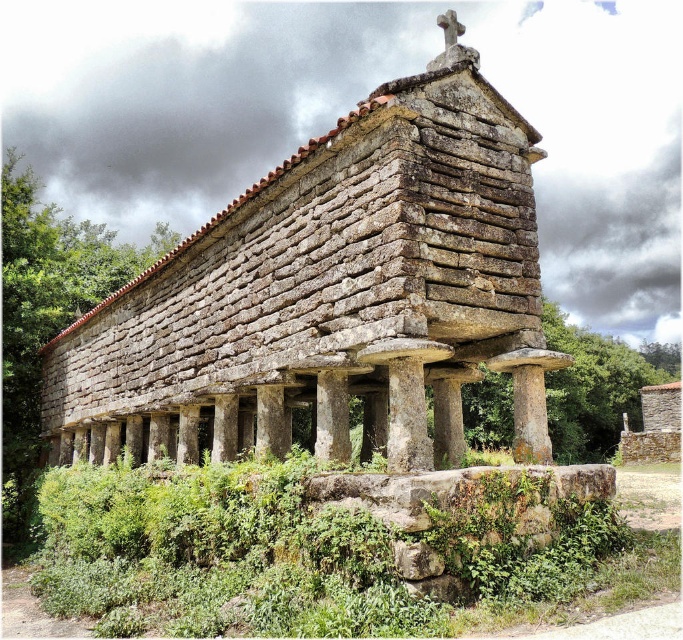
Question: In this image, where is gray stone pillar at center located relative to gray stone column at center?

Choices:
 (A) above
 (B) below

Answer: (A)

Question: Estimate the real-world distances between objects in this image. Which object is closer to the gray stone column at center?

Choices:
 (A) brown stone hut at center
 (B) gray stone pillar at center

Answer: (B)

Question: Where is green mossy stone at lower center located in relation to gray stone pillar at center in the image?

Choices:
 (A) left
 (B) right

Answer: (A)

Question: Based on their relative distances, which object is farther from the brown stone hut at center?

Choices:
 (A) gray stone pillar at center
 (B) green mossy stone at lower center

Answer: (A)

Question: Can you confirm if green mossy stone at lower center is positioned to the left of gray stone pillar at center?

Choices:
 (A) no
 (B) yes

Answer: (B)

Question: Among these points, which one is farthest from the camera?

Choices:
 (A) (273, 394)
 (B) (316, 438)
 (C) (48, 605)

Answer: (C)